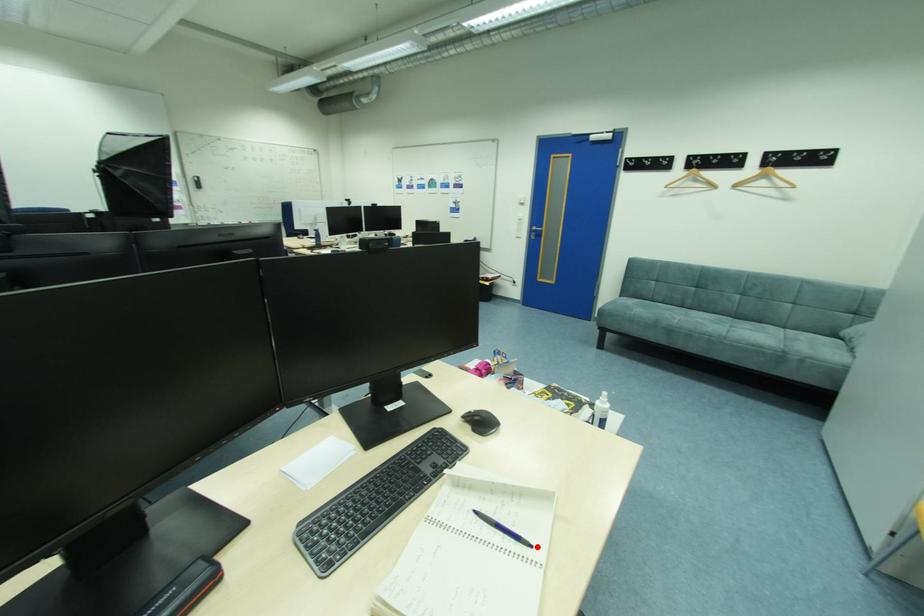
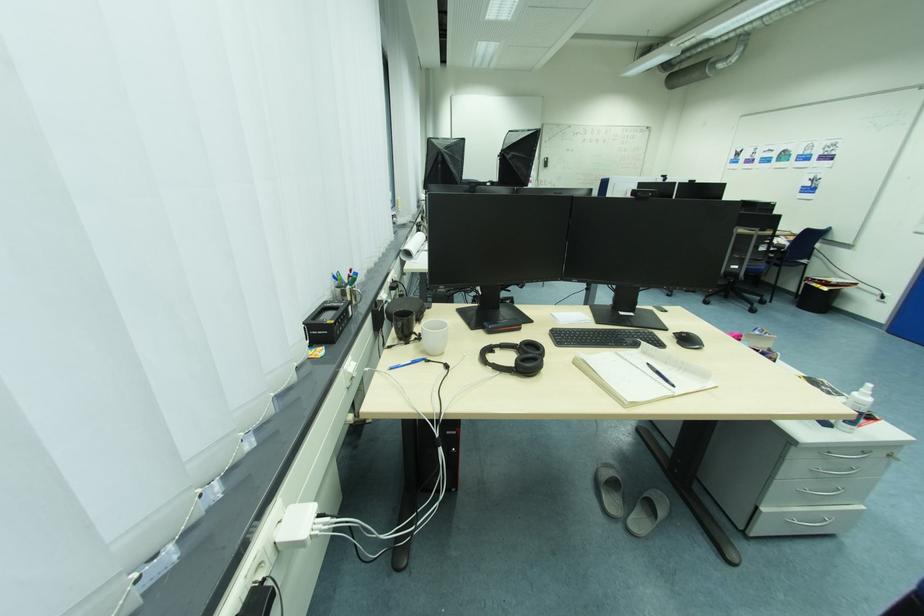
Find the pixel in the second image that matches the highlighted location in the first image.

(681, 387)